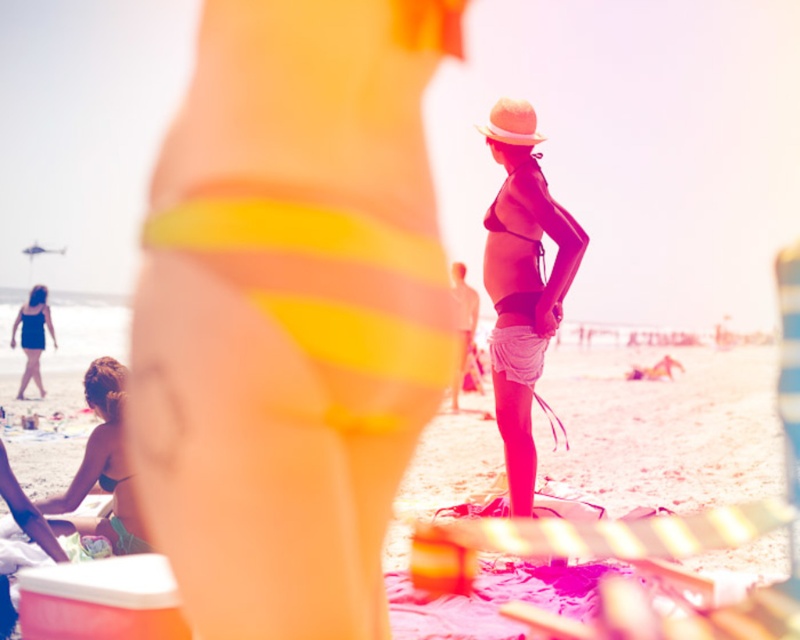
You are a photographer who wants to capture a closeup of the yellow fabric towel at center and the matte black bikini at center. Which one is positioned lower in the frame?

The yellow fabric towel at center is located below matte black bikini at center, so the yellow fabric towel at center is positioned lower in the frame.

You are a photographer trying to capture a closeup of the matte black bikini at center and the green matte bikini bottom at lower left. Which one do you need to move closer to the camera to ensure both are in focus?

The matte black bikini at center has a greater height compared to the green matte bikini bottom at lower left, so you need to move the green matte bikini bottom at lower left closer to the camera to ensure both are in focus.

You are a photographer trying to capture a photo of the matte black bikini at center and the matte black swimsuit at lower left. You want to ensure both subjects are in focus. Given that your camera has a depth of field range of 30 feet, will both subjects be in focus?

The matte black bikini at center is 36.68 feet from the matte black swimsuit at lower left. Since the distance between them exceeds the camera depth of field range of 30 feet, both subjects cannot be in focus simultaneously.